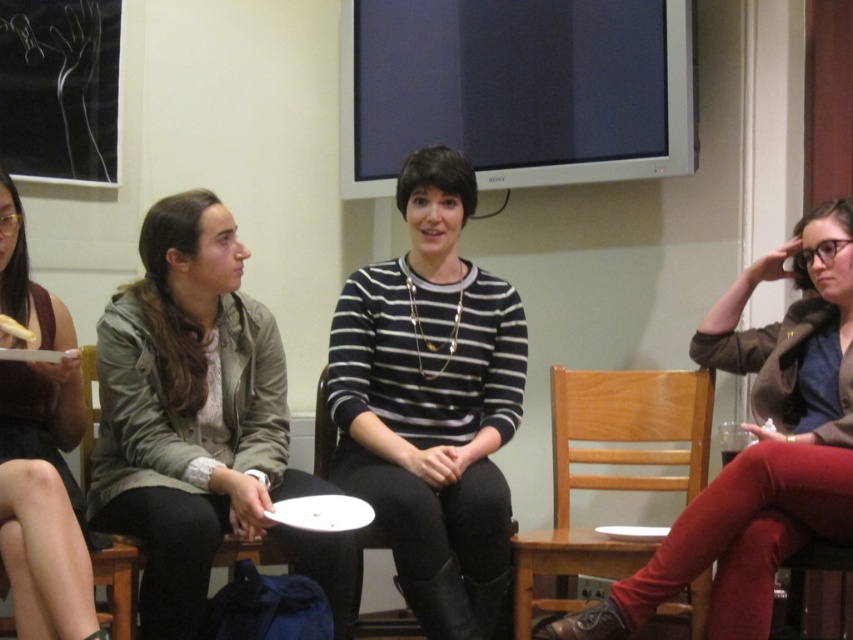
Question: Is green matte jacket at center wider than wooden chair at lower center?

Choices:
 (A) yes
 (B) no

Answer: (A)

Question: Which object is the closest to the white paper plate at center?

Choices:
 (A) green matte jacket at center
 (B) velvet red pants at right

Answer: (A)

Question: Which object is farther from the camera taking this photo?

Choices:
 (A) green matte jacket at center
 (B) wooden chair at lower center
 (C) matte black jacket at left

Answer: (B)

Question: Which point is closer to the camera taking this photo?

Choices:
 (A) pyautogui.click(x=831, y=317)
 (B) pyautogui.click(x=21, y=541)
 (C) pyautogui.click(x=381, y=540)

Answer: (B)

Question: Is green matte jacket at center further to the viewer compared to wooden chair at lower center?

Choices:
 (A) yes
 (B) no

Answer: (B)

Question: Does wooden chair at lower center appear over wooden chair at center?

Choices:
 (A) yes
 (B) no

Answer: (B)